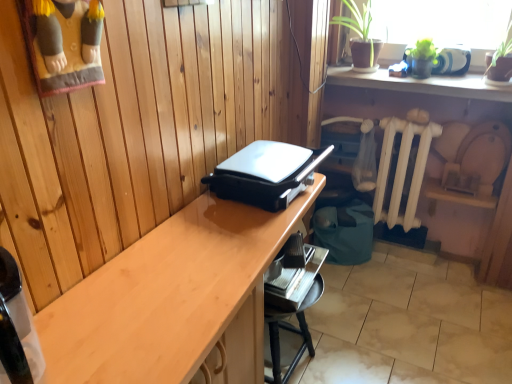
Question: Should I look upward or downward to see white painted metal radiator at lower right?

Choices:
 (A) down
 (B) up

Answer: (B)

Question: Is light wood desk at center aimed at black plastic waffle iron at center?

Choices:
 (A) yes
 (B) no

Answer: (B)

Question: Considering the relative sizes of light wood desk at center and black plastic waffle iron at center in the image provided, is light wood desk at center taller than black plastic waffle iron at center?

Choices:
 (A) no
 (B) yes

Answer: (B)

Question: Could black plastic waffle iron at center be considered to be inside light wood desk at center?

Choices:
 (A) no
 (B) yes

Answer: (A)

Question: From a real-world perspective, is light wood desk at center over black plastic waffle iron at center?

Choices:
 (A) no
 (B) yes

Answer: (A)

Question: Is light wood desk at center positioned far away from black plastic waffle iron at center?

Choices:
 (A) yes
 (B) no

Answer: (B)

Question: Is light wood desk at center looking in the opposite direction of black plastic waffle iron at center?

Choices:
 (A) no
 (B) yes

Answer: (A)

Question: Is light wood desk at center at the left side of green matte shelf at upper right?

Choices:
 (A) yes
 (B) no

Answer: (A)

Question: Can you confirm if light wood desk at center is wider than green matte shelf at upper right?

Choices:
 (A) no
 (B) yes

Answer: (B)

Question: Does light wood desk at center have a smaller size compared to green matte shelf at upper right?

Choices:
 (A) no
 (B) yes

Answer: (A)

Question: Can we say light wood desk at center lies outside green matte shelf at upper right?

Choices:
 (A) no
 (B) yes

Answer: (B)

Question: From a real-world perspective, is light wood desk at center positioned under green matte shelf at upper right based on gravity?

Choices:
 (A) yes
 (B) no

Answer: (A)

Question: Can you confirm if light wood desk at center is thinner than green matte shelf at upper right?

Choices:
 (A) no
 (B) yes

Answer: (A)

Question: Is white painted metal radiator at lower right not close to black plastic waffle iron at center?

Choices:
 (A) no
 (B) yes

Answer: (A)